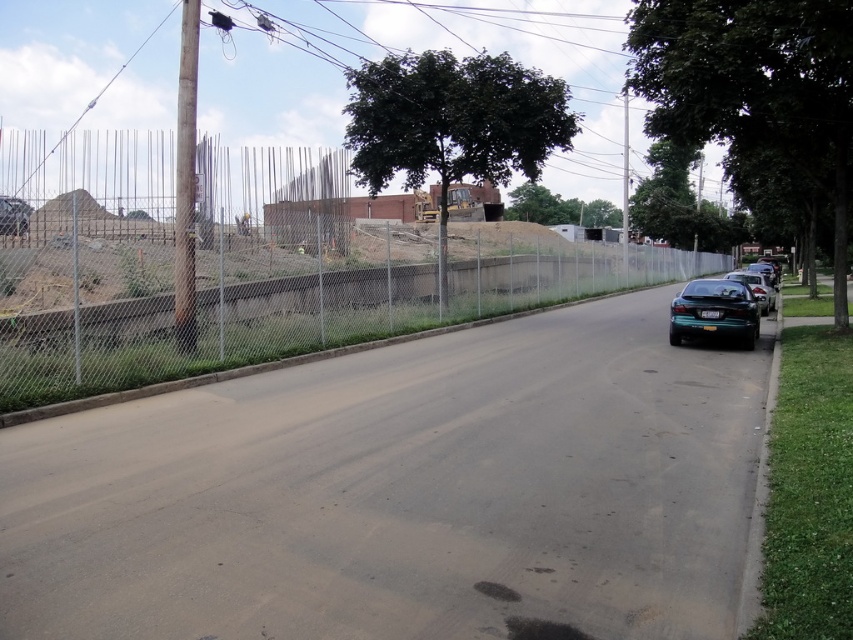
In the scene shown: Between chain-link fence at center and green matte car at right, which one has more height?

Standing taller between the two is chain-link fence at center.

Who is positioned more to the left, chain-link fence at center or green matte car at right?

chain-link fence at center

Locate an element on the screen. The width and height of the screenshot is (853, 640). chain-link fence at center is located at coordinates (265, 264).

Does metallic wire at upper center appear on the left side of green glossy sedan at right?

No, metallic wire at upper center is not to the left of green glossy sedan at right.

Is point (350, 20) positioned after point (735, 280)?

Yes, it is.

The height and width of the screenshot is (640, 853). In order to click on metallic wire at upper center in this screenshot , I will do `click(418, 51)`.

From the picture: Is chain-link fence at center below metallic wire at upper center?

Yes, chain-link fence at center is below metallic wire at upper center.

Between point (196, 308) and point (271, 90), which one is positioned behind?

Positioned behind is point (271, 90).

Which is behind, point (277, 189) or point (256, 122)?

Positioned behind is point (256, 122).

At what (x,y) coordinates should I click in order to perform the action: click on chain-link fence at center. Please return your answer as a coordinate pair (x, y). The image size is (853, 640). Looking at the image, I should click on (265, 264).